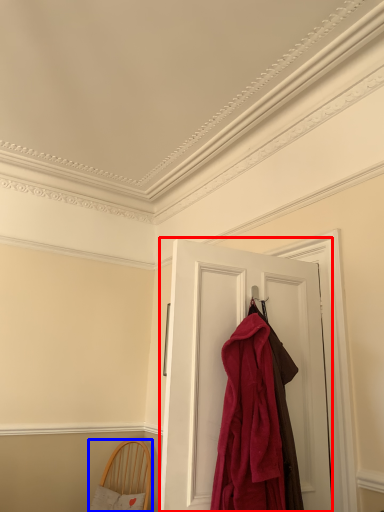
Question: Among these objects, which one is nearest to the camera, door (highlighted by a red box) or furniture (highlighted by a blue box)?

Choices:
 (A) door
 (B) furniture

Answer: (A)